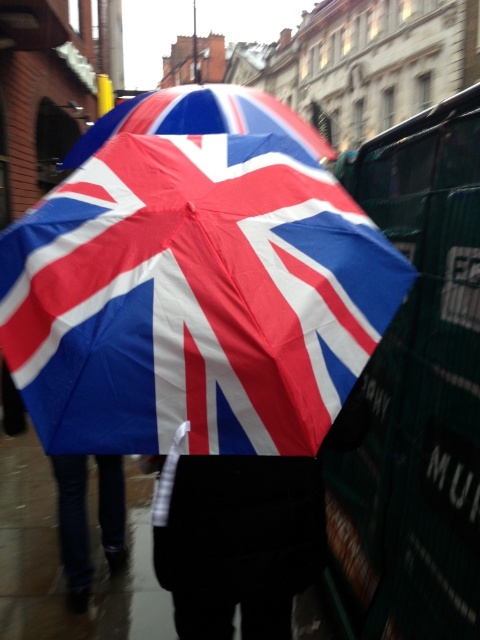
You are standing in the rain and see a person wearing a velvet black coat at center and holding a matte plastic umbrella at center. Which item is closer to you?

The velvet black coat at center is closer to the viewer than the matte plastic umbrella at center.

You are a delivery person who needs to protect a package from the rain. The package is placed on the jeans at lower left. Can the matte plastic umbrella at center cover the package completely?

The matte plastic umbrella at center might be wider than jeans at lower left, so it could potentially cover the package completely if positioned correctly.

You are a photographer trying to capture both the polyester umbrella at center and the matte plastic umbrella at center in a single shot. Based on their positions, which one would appear closer to the camera?

The polyester umbrella at center is located below the matte plastic umbrella at center, so the polyester umbrella at center would appear closer to the camera since it is positioned lower in the frame.